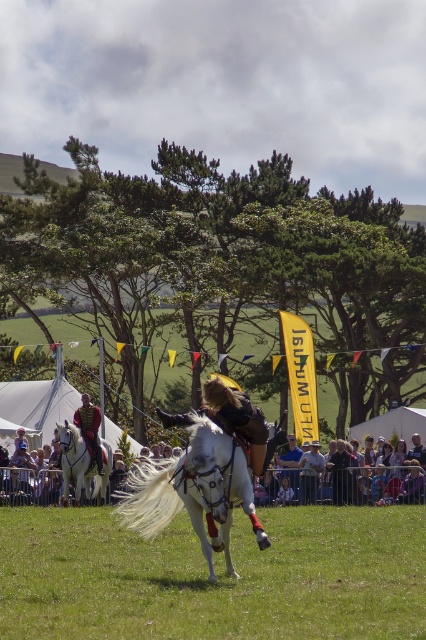
You are a photographer at the equestrian event. You want to capture a photo where the green grass at center is clearly visible and fills more of the frame than the white glossy horse at left. Based on the scene description, will this be possible?

The green grass at center is bigger than the white glossy horse at left, so yes, the photographer can capture a photo where the green grass at center fills more of the frame than the white glossy horse at left.

You are a photographer at the equestrian event. You want to capture a photo of the white glossy horse at center and the smooth fabric crowd at center together in the frame. The camera you are using has a minimum focusing distance of 3 meters. Will you be able to take the photo without moving closer?

The distance between the white glossy horse at center and the smooth fabric crowd at center is 4.21 meters. Since the minimum focusing distance is 3 meters, the photographer can capture both subjects in the frame without moving closer as the distance is sufficient.